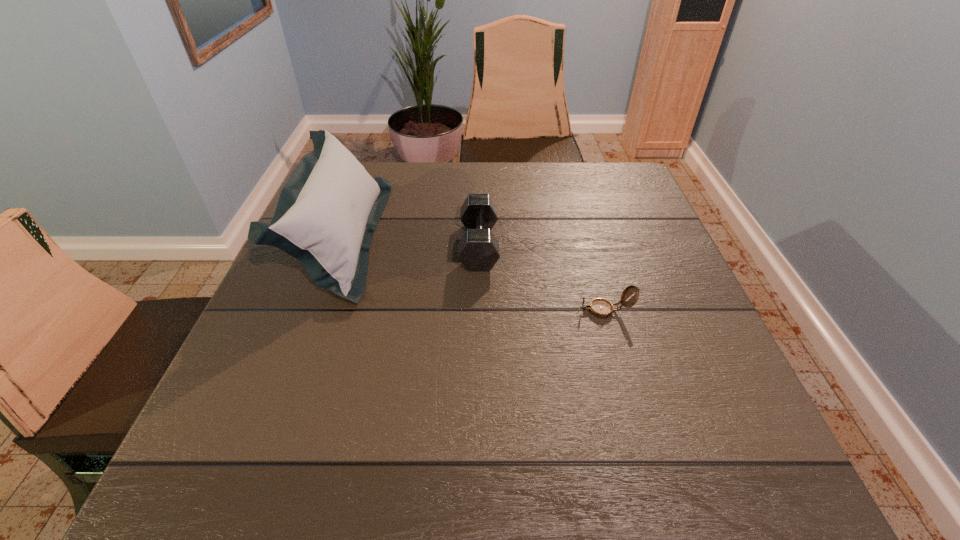
Image resolution: width=960 pixels, height=540 pixels. In order to click on vacant space positioned on the face of the compass in this screenshot , I will do `click(498, 310)`.

You are a GUI agent. You are given a task and a screenshot of the screen. Output one action in this format:
    pyautogui.click(x=<x>, y=<y>)
    Task: Click on the object that is at the far edge
    The width and height of the screenshot is (960, 540).
    Given the screenshot: What is the action you would take?
    pyautogui.click(x=327, y=212)

Image resolution: width=960 pixels, height=540 pixels. In order to click on object that is at the left edge in this screenshot , I will do `click(327, 212)`.

I want to click on object that is at the right edge, so click(x=601, y=308).

The height and width of the screenshot is (540, 960). Find the location of `object at the far left corner`. object at the far left corner is located at coordinates (327, 212).

This screenshot has width=960, height=540. In the image, there is a desktop. What are the coordinates of `vacant space at the far edge` in the screenshot? It's located at (522, 188).

I want to click on free point at the near edge, so click(637, 481).

You are a GUI agent. You are given a task and a screenshot of the screen. Output one action in this format:
    pyautogui.click(x=<x>, y=<y>)
    Task: Click on the vacant region at the left edge of the desktop
    The width and height of the screenshot is (960, 540).
    Given the screenshot: What is the action you would take?
    pyautogui.click(x=308, y=330)

Identify the location of vacant area at the right edge of the desktop. The height and width of the screenshot is (540, 960). (682, 344).

Find the location of a particular element. This screenshot has height=540, width=960. unoccupied position between the cushion and the second shortest object is located at coordinates (410, 241).